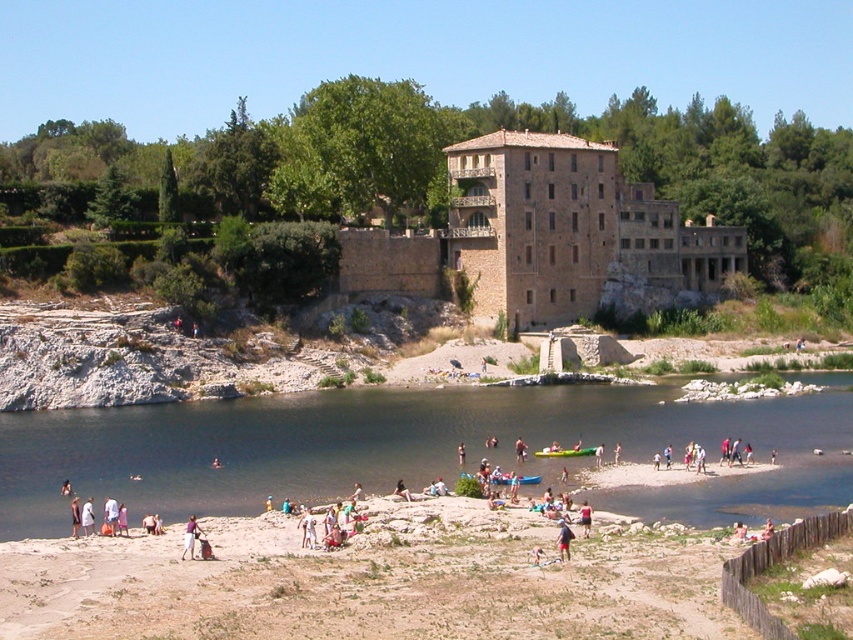
Can you confirm if dark blue water at lower center is wider than red fabric bag at center?

Correct, the width of dark blue water at lower center exceeds that of red fabric bag at center.

Which is in front, point (3, 497) or point (582, 532)?

Point (582, 532)

The image size is (853, 640). I want to click on dark blue water at lower center, so click(415, 449).

Who is shorter, red fabric bag at center or light brown fabric pants at lower center?

light brown fabric pants at lower center is shorter.

Measure the distance between point (579, 508) and camera.

Point (579, 508) and camera are 64.58 meters apart.

Is point (585, 522) positioned after point (125, 525)?

That is False.

Find the location of `red fabric bag at center`. red fabric bag at center is located at coordinates (585, 518).

Which is more to the right, dark blue water at lower center or light pink fabric at lower center?

dark blue water at lower center

Based on the photo, which is more to the left, dark blue water at lower center or light pink fabric at lower center?

From the viewer's perspective, light pink fabric at lower center appears more on the left side.

Between point (738, 493) and point (198, 536), which one is positioned behind?

Point (738, 493)

Locate an element on the screen. This screenshot has width=853, height=640. dark blue water at lower center is located at coordinates (415, 449).